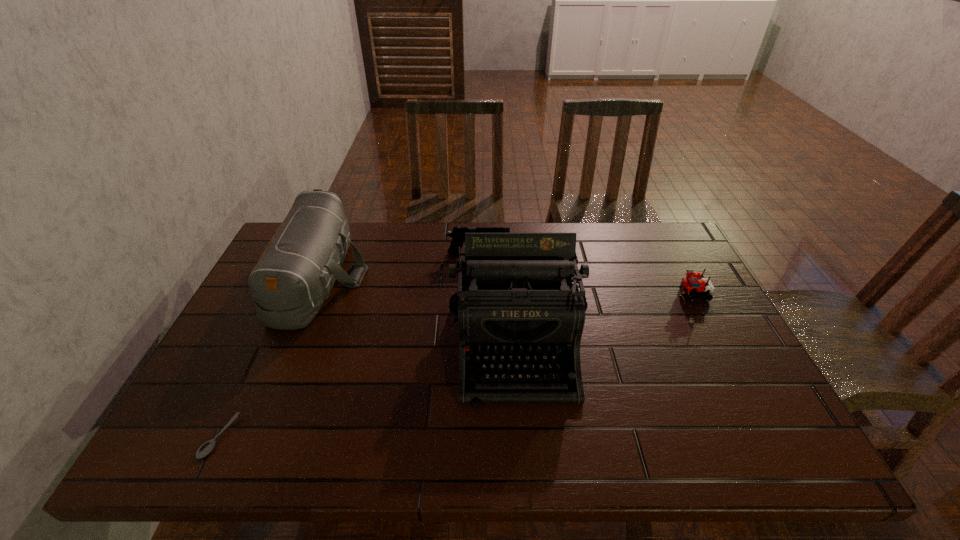
I want to click on free point located on the front-facing side of the Lego, so click(655, 294).

Identify the location of free location located on the front-facing side of the Lego. The image size is (960, 540). (624, 294).

Identify the location of free space located 0.230m on the front-facing side of the Lego. pyautogui.click(x=600, y=294).

The height and width of the screenshot is (540, 960). Find the location of `blank space located 0.150m on the right of the shortest object`. blank space located 0.150m on the right of the shortest object is located at coordinates click(303, 437).

The image size is (960, 540). I want to click on duffel bag that is at the far edge, so 294,275.

Find the location of a particular element. The image size is (960, 540). gun situated at the far edge is located at coordinates (458, 233).

I want to click on object present at the near edge, so click(x=207, y=447).

This screenshot has width=960, height=540. I want to click on duffel bag that is at the left edge, so click(294, 275).

At what (x,y) coordinates should I click in order to perform the action: click on soupspoon that is at the left edge. Please return your answer as a coordinate pair (x, y). The width and height of the screenshot is (960, 540). Looking at the image, I should click on 207,447.

Find the location of a particular element. This screenshot has height=540, width=960. object that is positioned at the right edge is located at coordinates (690, 284).